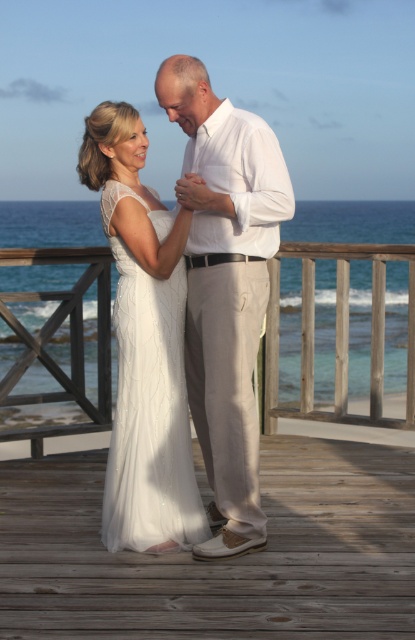
Question: In this image, where is wooden at center located relative to white lace dress at center?

Choices:
 (A) left
 (B) right

Answer: (B)

Question: Among these objects, which one is nearest to the camera?

Choices:
 (A) white cotton shirt at center
 (B) white lace dress at center
 (C) wooden at center

Answer: (A)

Question: Estimate the real-world distances between objects in this image. Which object is closer to the white cotton shirt at center?

Choices:
 (A) white lace dress at center
 (B) wooden at center

Answer: (A)

Question: Observing the image, what is the correct spatial positioning of wooden at center in reference to white lace dress at center?

Choices:
 (A) below
 (B) above

Answer: (A)

Question: Does white cotton shirt at center appear under white lace dress at center?

Choices:
 (A) no
 (B) yes

Answer: (A)

Question: Considering the real-world distances, which object is farthest from the white lace dress at center?

Choices:
 (A) wooden at center
 (B) white cotton shirt at center

Answer: (A)